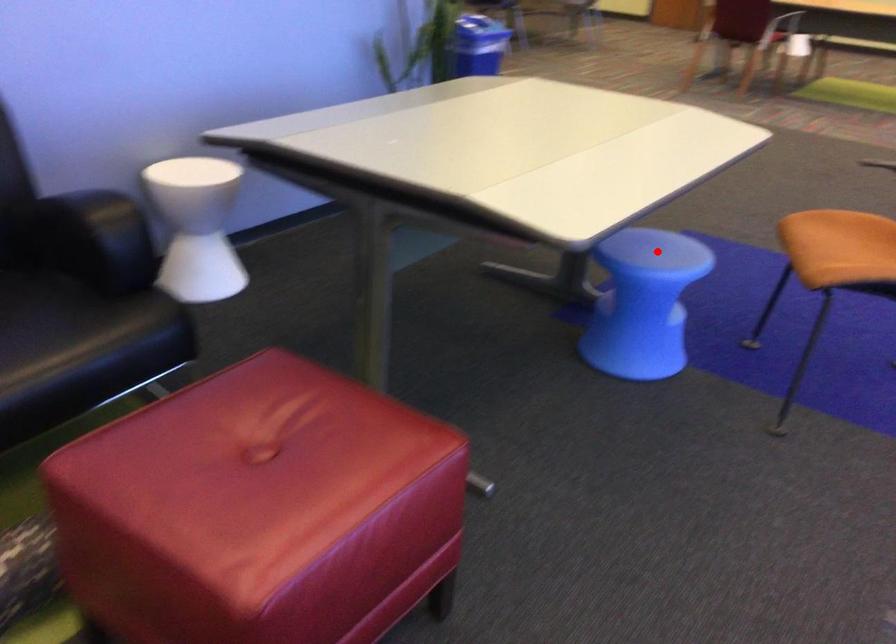
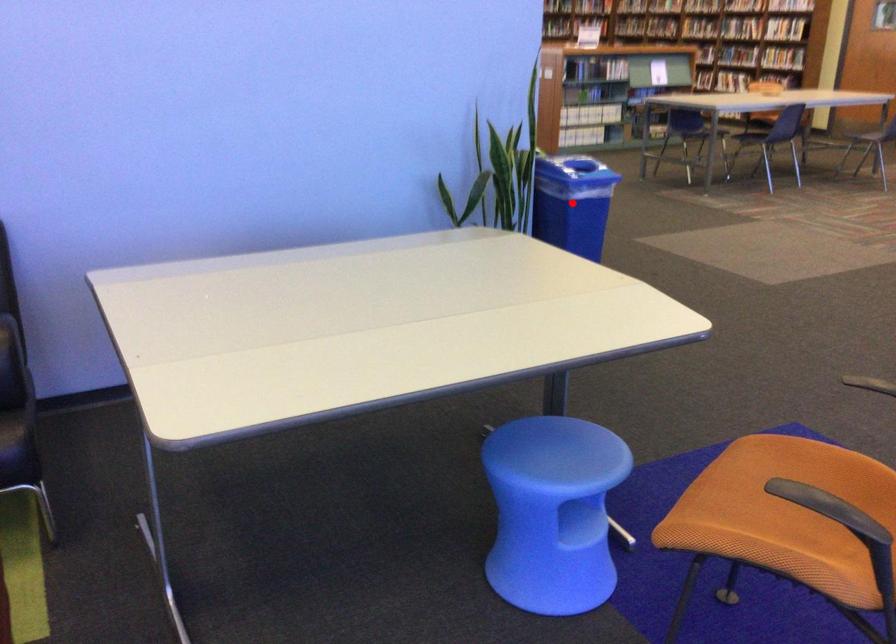
I am providing you with two images of the same scene from different viewpoints. A red point is marked on the first image and another point is marked on the second image. Do the highlighted points in image1 and image2 indicate the same real-world spot?

No